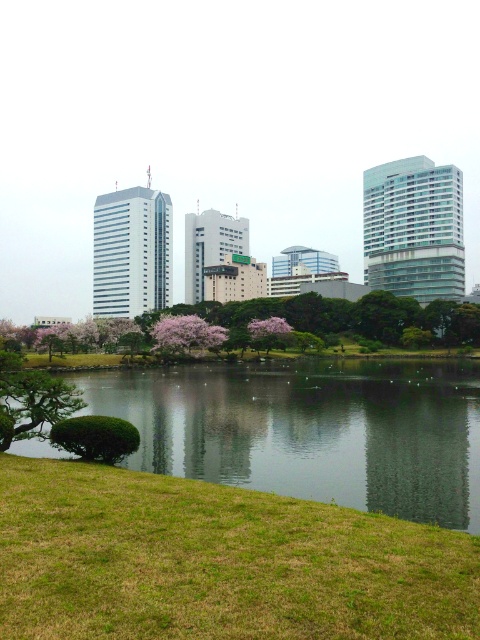
You are planning to set up a small picnic area in the scene. Which of the two green areas, the green grassy at lower left or the green grassy bank at lower left, would be more suitable for accommodating a picnic blanket?

The green grassy bank at lower left is more suitable for accommodating a picnic blanket because it is larger than the green grassy at lower left.